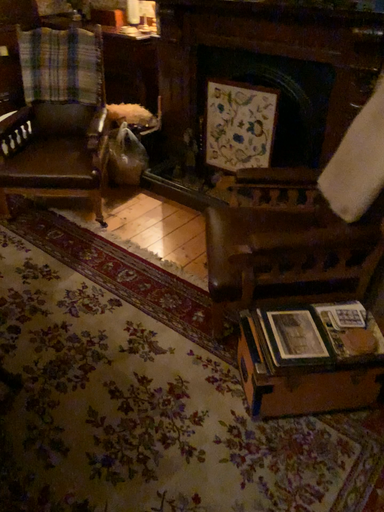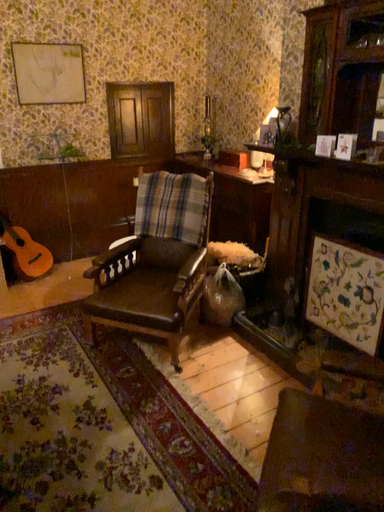
Question: How did the camera likely rotate when shooting the video?

Choices:
 (A) rotated downward
 (B) rotated upward

Answer: (B)